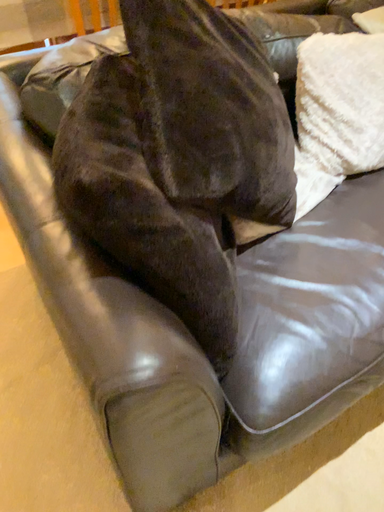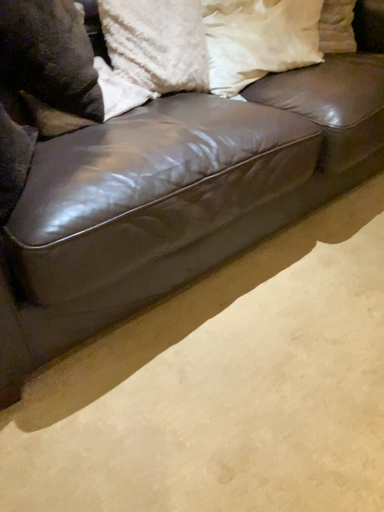
Question: How did the camera likely rotate when shooting the video?

Choices:
 (A) rotated right
 (B) rotated left

Answer: (A)